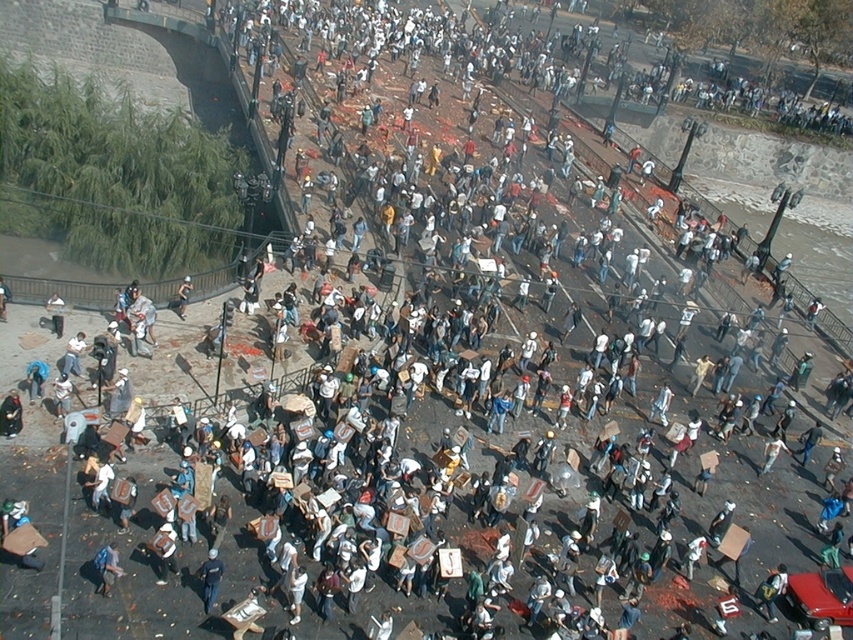
You are a photographer standing in the public square and want to capture both the point at coordinate (102, 573) and the point at coordinate (178, 305) in your photo. Since you know that one of them is closer to you, which point should you focus on first to ensure both are in focus?

You should focus on point (178, 305) first because it is farther away from the camera than point (102, 573). By focusing on the farther point, the closer point will also be within the depth of field, ensuring both are in focus.

You are a photographer standing at the edge of the crowd in the public square. You want to take a photo of the dark blue uniform at center. Where should you aim your camera to capture it?

You should aim your camera at the point with coordinates 0.905 in the x direction and 0.247 in the y direction to capture the dark blue uniform at center.